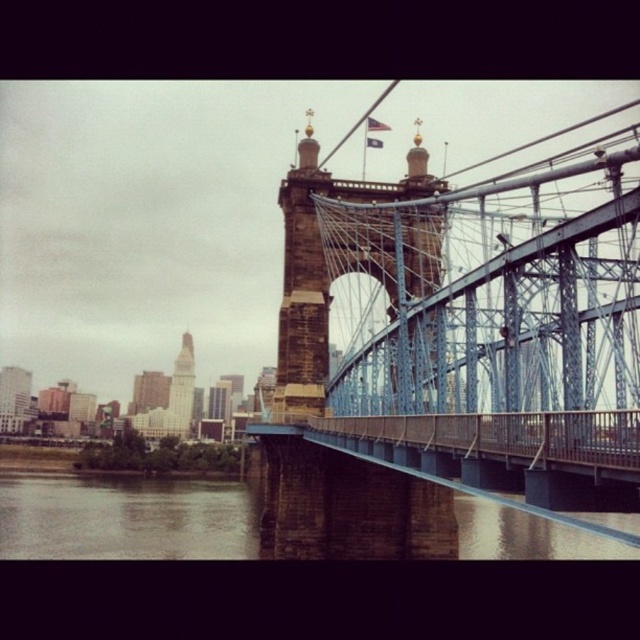
Who is more forward, (x=180, y=397) or (x=13, y=381)?

Point (x=13, y=381) is in front.

Is white glass skyscraper at center-left positioned in front of matte glass skyscraper at left?

That is True.

Is point (179, 362) in front of point (19, 376)?

No, it is not.

Where is `white glass skyscraper at center-left`? white glass skyscraper at center-left is located at coordinates (180, 390).

Is blue steel suspension bridge at center smaller than brown stone river at lower center?

No, blue steel suspension bridge at center is not smaller than brown stone river at lower center.

This screenshot has width=640, height=640. What do you see at coordinates (472, 321) in the screenshot? I see `blue steel suspension bridge at center` at bounding box center [472, 321].

Which is behind, point (298, 492) or point (573, 516)?

The point (298, 492) is behind.

This screenshot has height=640, width=640. In order to click on blue steel suspension bridge at center in this screenshot , I will do `click(472, 321)`.

Which is behind, point (436, 186) or point (189, 374)?

The point (189, 374) is behind.

Locate an element on the screen. The height and width of the screenshot is (640, 640). blue steel suspension bridge at center is located at coordinates (472, 321).